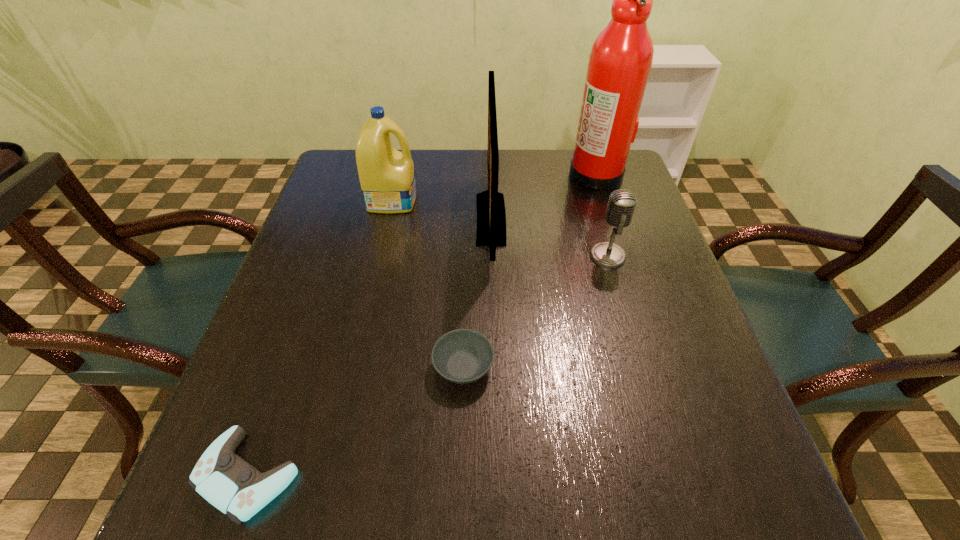
Where is `object that can be found as the fourth closest to the second nearest object`? object that can be found as the fourth closest to the second nearest object is located at coordinates (387, 178).

Image resolution: width=960 pixels, height=540 pixels. I want to click on free space that satisfies the following two spatial constraints: 1. on the label of the detergent; 2. on the right side of the microphone, so [x=379, y=256].

The height and width of the screenshot is (540, 960). In order to click on blank space that satisfies the following two spatial constraints: 1. on the front-facing side of the monitor; 2. on the right side of the microphone in this screenshot , I will do `click(492, 256)`.

This screenshot has width=960, height=540. In order to click on vacant space that satisfies the following two spatial constraints: 1. on the label of the fourth shortest object; 2. on the back side of the microphone in this screenshot , I will do `click(379, 256)`.

Find the location of a particular element. blank area in the image that satisfies the following two spatial constraints: 1. on the label of the fourth shortest object; 2. on the right side of the fourth tallest object is located at coordinates (379, 256).

The image size is (960, 540). What are the coordinates of `vacant space that satisfies the following two spatial constraints: 1. on the back side of the third shortest object; 2. on the front-facing side of the monitor` in the screenshot? It's located at (597, 219).

Find the location of a particular element. This screenshot has height=540, width=960. free space that satisfies the following two spatial constraints: 1. on the label of the second nearest object; 2. on the left side of the fourth shortest object is located at coordinates (353, 367).